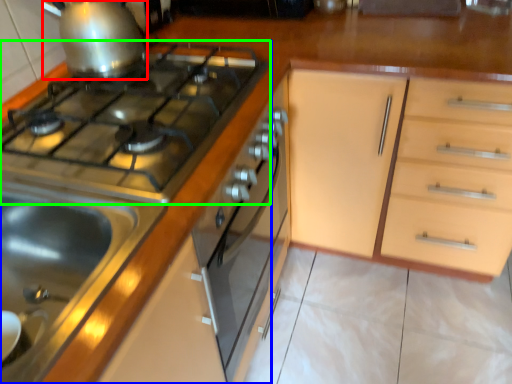
Question: Considering the real-world distances, which object is farthest from kitchen appliance (highlighted by a red box)? kitchen appliance (highlighted by a blue box) or gas stove (highlighted by a green box)?

Choices:
 (A) kitchen appliance
 (B) gas stove

Answer: (A)